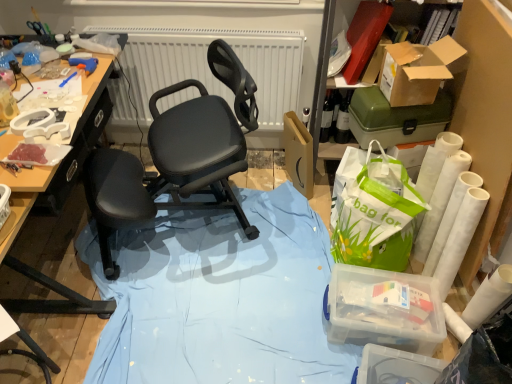
Image resolution: width=512 pixels, height=384 pixels. I want to click on vacant space situated on the left part of clear plastic container at lower right, the second box in the bottom-to-top sequence, so click(286, 311).